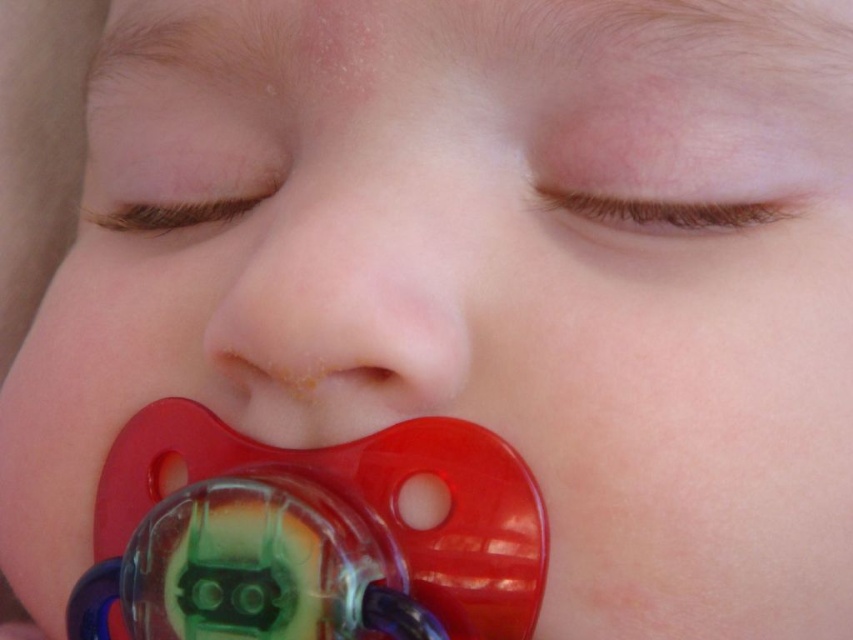
Measure the distance from translucent plastic pacifier at lower center to matte plastic pacifier at center.

A distance of 1.56 inches exists between translucent plastic pacifier at lower center and matte plastic pacifier at center.

Find the location of a particular element. translucent plastic pacifier at lower center is located at coordinates (367, 502).

Image resolution: width=853 pixels, height=640 pixels. I want to click on translucent plastic pacifier at lower center, so click(367, 502).

Can you confirm if smooth skin nose at center is bigger than matte plastic pacifier at center?

Yes, smooth skin nose at center is bigger than matte plastic pacifier at center.

Find the location of `smooth skin nose at center`. smooth skin nose at center is located at coordinates (341, 298).

You are a GUI agent. You are given a task and a screenshot of the screen. Output one action in this format:
    pyautogui.click(x=<x>, y=<y>)
    Task: Click on the smooth skin nose at center
    The height and width of the screenshot is (640, 853).
    Given the screenshot: What is the action you would take?
    pyautogui.click(x=341, y=298)

This screenshot has height=640, width=853. Identify the location of smooth skin nose at center. (341, 298).

Does smooth skin nose at center appear over translucent plastic pacifier at lower center?

Correct, smooth skin nose at center is located above translucent plastic pacifier at lower center.

Who is more forward, (402, 381) or (485, 499)?

Point (402, 381)

This screenshot has width=853, height=640. In order to click on smooth skin nose at center in this screenshot , I will do `click(341, 298)`.